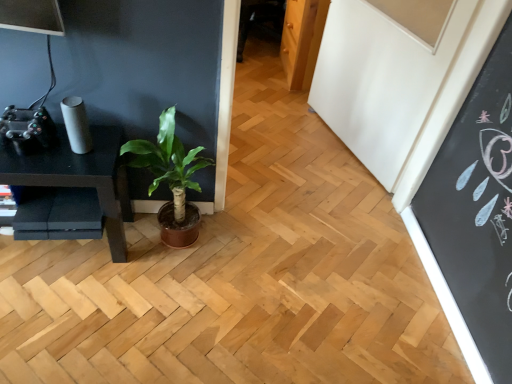
The width and height of the screenshot is (512, 384). In order to click on vacant space in front of green leafy plant at center in this screenshot , I will do `click(154, 300)`.